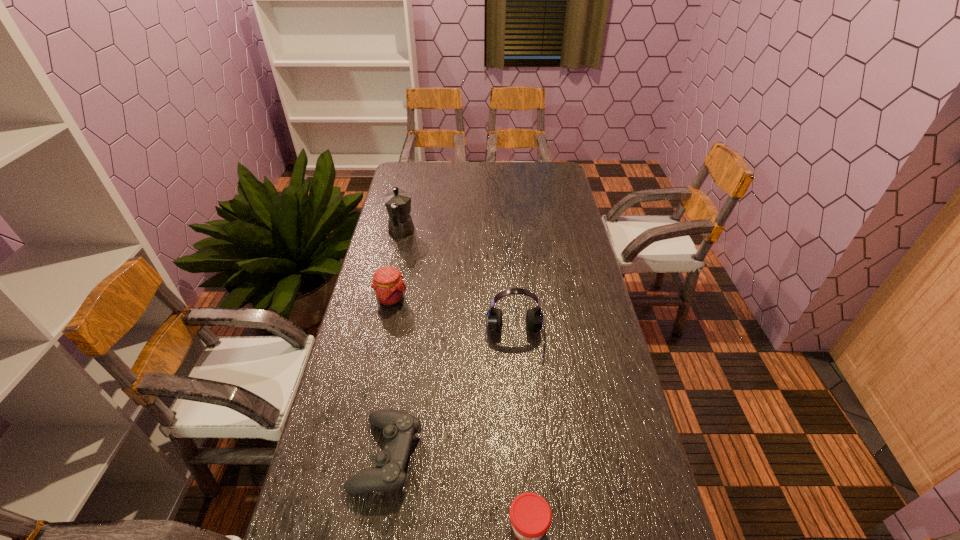
What are the coordinates of `coffeepot` in the screenshot? It's located at (398, 202).

Where is `the farthest object`? The width and height of the screenshot is (960, 540). the farthest object is located at coordinates (398, 202).

Where is `the third nearest object`? The height and width of the screenshot is (540, 960). the third nearest object is located at coordinates (534, 318).

Find the location of a particular element. the second tallest object is located at coordinates (534, 318).

Find the location of `the third shortest object`. the third shortest object is located at coordinates (389, 288).

What are the coordinates of `the second farthest object` in the screenshot? It's located at (389, 288).

Identify the location of the fourth farthest object. The width and height of the screenshot is (960, 540). (399, 428).

In order to click on vacant area located 0.250m on the pouring side of the farthest object in this screenshot , I will do `click(411, 189)`.

The width and height of the screenshot is (960, 540). Find the location of `vacant area located 0.320m on the pouring side of the farthest object`. vacant area located 0.320m on the pouring side of the farthest object is located at coordinates (413, 181).

Where is `free space located on the pouring side of the farthest object`? This screenshot has width=960, height=540. free space located on the pouring side of the farthest object is located at coordinates (408, 203).